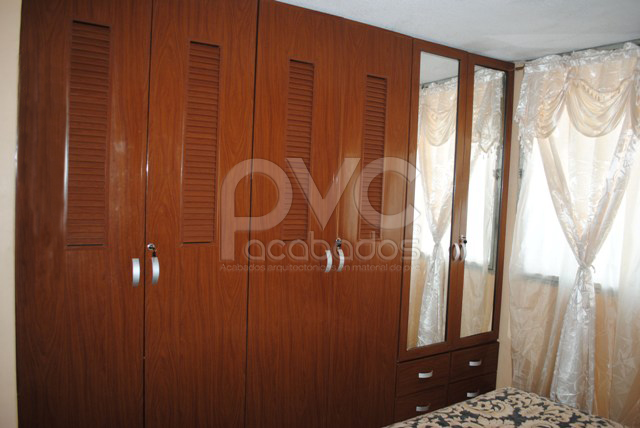
The image size is (640, 428). Identify the location of wooden cabinet/closet. (203, 308).